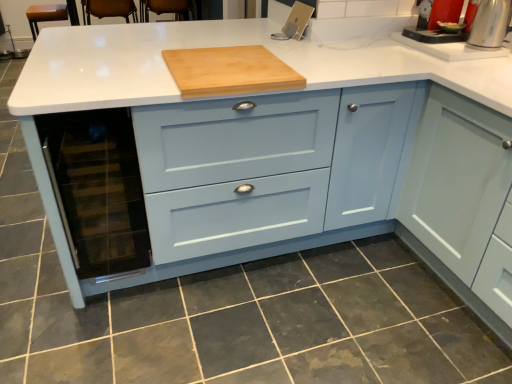
The image size is (512, 384). Find the location of `vacant region in front of transparent glass wine cooler at lower left`. vacant region in front of transparent glass wine cooler at lower left is located at coordinates (102, 332).